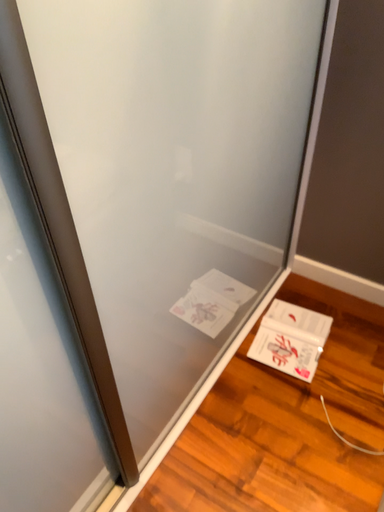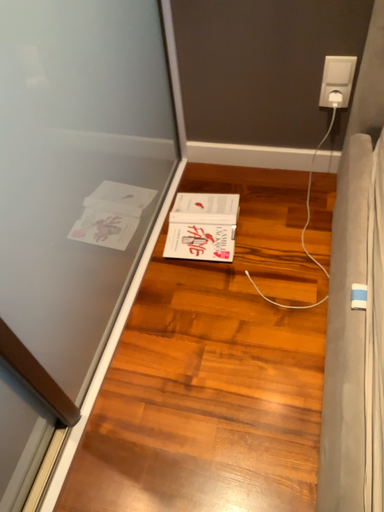
Question: Which way did the camera rotate in the video?

Choices:
 (A) rotated upward
 (B) rotated downward

Answer: (B)